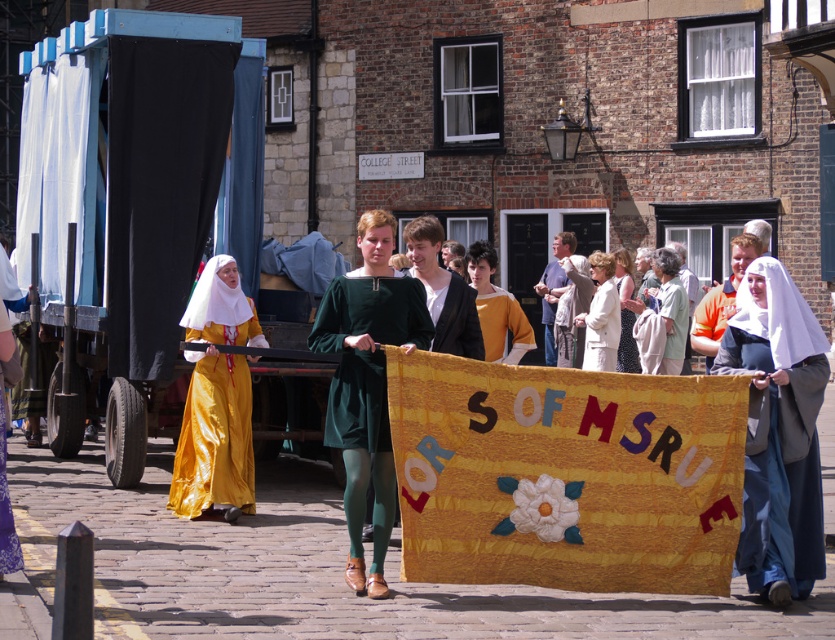
Does green velvet robe at center appear under light beige fabric at center?

Correct, green velvet robe at center is located below light beige fabric at center.

Does green velvet robe at center come in front of light beige fabric at center?

Yes.

Is point (439, 268) positioned behind point (674, 269)?

No.

Locate an element on the screen. green velvet robe at center is located at coordinates (444, 291).

Between shiny gold dress at left and white satin robe at center, which one appears on the left side from the viewer's perspective?

Positioned to the left is shiny gold dress at left.

Can you confirm if shiny gold dress at left is taller than white satin robe at center?

Correct, shiny gold dress at left is much taller as white satin robe at center.

At what (x,y) coordinates should I click in order to perform the action: click on shiny gold dress at left. Please return your answer as a coordinate pair (x, y). Looking at the image, I should click on pyautogui.click(x=214, y=440).

Can you confirm if white fabric coat at center is shorter than white lace dress at center?

Incorrect, white fabric coat at center's height does not fall short of white lace dress at center's.

Who is more forward, (584, 362) or (616, 356)?

Point (616, 356) is more forward.

In order to click on white fabric coat at center in this screenshot , I will do `click(601, 316)`.